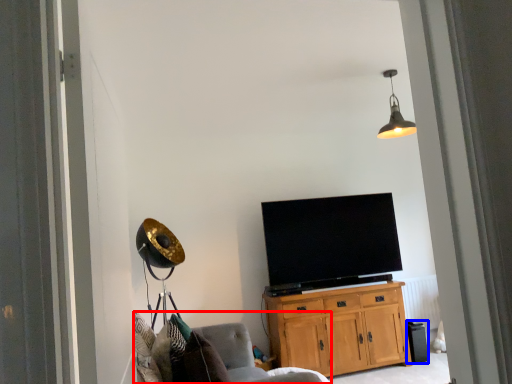
Question: Which object is closer to the camera taking this photo, chair (highlighted by a red box) or trash bin/can (highlighted by a blue box)?

Choices:
 (A) chair
 (B) trash bin/can

Answer: (A)